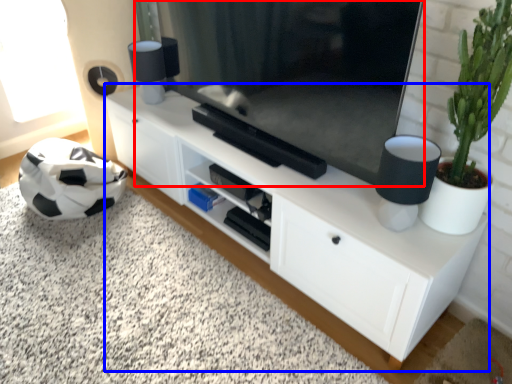
Question: Among these objects, which one is nearest to the camera, television (highlighted by a red box) or cabinetry (highlighted by a blue box)?

Choices:
 (A) television
 (B) cabinetry

Answer: (A)